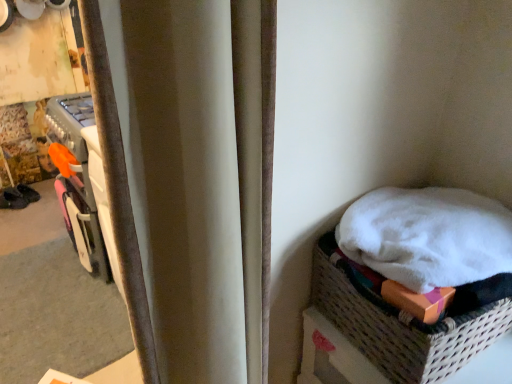
Question: Can you confirm if dark brown leather shoe at left is taller than white woven basket at lower right?

Choices:
 (A) no
 (B) yes

Answer: (A)

Question: From a real-world perspective, is dark brown leather shoe at left physically above white woven basket at lower right?

Choices:
 (A) no
 (B) yes

Answer: (A)

Question: Is dark brown leather shoe at left at the right side of white woven basket at lower right?

Choices:
 (A) yes
 (B) no

Answer: (B)

Question: Is dark brown leather shoe at left at the left side of white woven basket at lower right?

Choices:
 (A) no
 (B) yes

Answer: (B)

Question: Can we say dark brown leather shoe at left lies outside white woven basket at lower right?

Choices:
 (A) no
 (B) yes

Answer: (B)

Question: From the image's perspective, is white woven basket at lower right above or below velvet curtain at center?

Choices:
 (A) above
 (B) below

Answer: (B)

Question: Is white woven basket at lower right to the left or to the right of velvet curtain at center in the image?

Choices:
 (A) right
 (B) left

Answer: (A)

Question: Looking at their shapes, would you say white woven basket at lower right is wider or thinner than velvet curtain at center?

Choices:
 (A) wide
 (B) thin

Answer: (A)

Question: Is point (417, 344) positioned closer to the camera than point (177, 241)?

Choices:
 (A) closer
 (B) farther

Answer: (B)

Question: Relative to white woven basket at lower right, is velvet curtain at center in front or behind?

Choices:
 (A) behind
 (B) front

Answer: (B)

Question: Is point (201, 349) positioned closer to the camera than point (328, 284)?

Choices:
 (A) farther
 (B) closer

Answer: (B)

Question: Looking at the image, does velvet curtain at center seem bigger or smaller compared to white woven basket at lower right?

Choices:
 (A) small
 (B) big

Answer: (B)

Question: From a real-world perspective, is velvet curtain at center physically located above or below white woven basket at lower right?

Choices:
 (A) above
 (B) below

Answer: (A)

Question: From their relative heights in the image, would you say white woven basket at lower right is taller or shorter than dark brown leather shoe at left?

Choices:
 (A) tall
 (B) short

Answer: (A)

Question: From a real-world perspective, is white woven basket at lower right above or below dark brown leather shoe at left?

Choices:
 (A) below
 (B) above

Answer: (B)